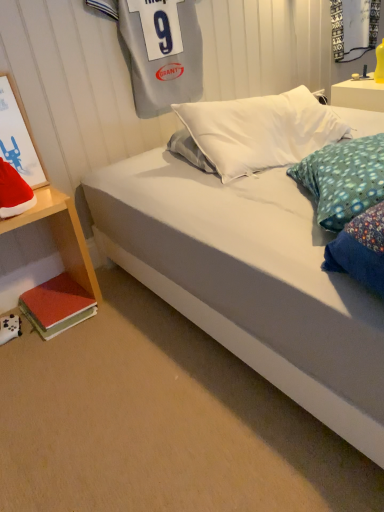
Question: From a real-world perspective, is red velvet santa hat at left physically located above or below white glossy nightstand at upper right, the first nightstand viewed from the top?

Choices:
 (A) above
 (B) below

Answer: (A)

Question: From the image's perspective, is red velvet santa hat at left positioned above or below white glossy nightstand at upper right, marked as the 2th nightstand in a front-to-back arrangement?

Choices:
 (A) above
 (B) below

Answer: (B)

Question: Estimate the real-world distances between objects in this image. Which object is farther from the white fabric bed at lower left?

Choices:
 (A) transparent glass shop window at upper right
 (B) matte white picture frame at left
 (C) red velvet santa hat at left
 (D) red matte book at lower left
 (E) wooden nightstand at lower left, which is counted as the second nightstand, starting from the top

Answer: (A)

Question: Estimate the real-world distances between objects in this image. Which object is closer to the white glossy nightstand at upper right, the first nightstand viewed from the top?

Choices:
 (A) wooden nightstand at lower left, which is counted as the second nightstand, starting from the top
 (B) transparent glass shop window at upper right
 (C) white fabric bed at lower left
 (D) matte white picture frame at left
 (E) red velvet santa hat at left

Answer: (B)